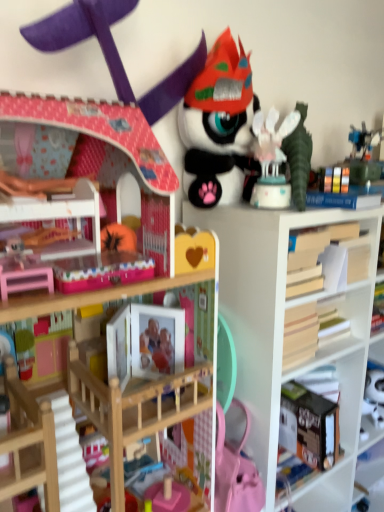
Question: Should I look upward or downward to see wooden book at right?

Choices:
 (A) up
 (B) down

Answer: (A)

Question: Is wooden bookcase at upper left outside of white matte bookshelf at center?

Choices:
 (A) yes
 (B) no

Answer: (A)

Question: From the image's perspective, is wooden bookcase at upper left beneath white matte bookshelf at center?

Choices:
 (A) no
 (B) yes

Answer: (A)

Question: From the image's perspective, is wooden bookcase at upper left above white matte bookshelf at center?

Choices:
 (A) no
 (B) yes

Answer: (B)

Question: Does wooden bookcase at upper left have a lesser width compared to white matte bookshelf at center?

Choices:
 (A) no
 (B) yes

Answer: (B)

Question: Is wooden bookcase at upper left far away from white matte bookshelf at center?

Choices:
 (A) no
 (B) yes

Answer: (A)

Question: From a real-world perspective, is wooden bookcase at upper left below white matte bookshelf at center?

Choices:
 (A) no
 (B) yes

Answer: (A)

Question: From a real-world perspective, is white glossy cake at upper right, the first toy viewed from the right, positioned over wooden book at right based on gravity?

Choices:
 (A) no
 (B) yes

Answer: (B)

Question: From the image's perspective, is white glossy cake at upper right, the first toy viewed from the right, on wooden book at right?

Choices:
 (A) yes
 (B) no

Answer: (A)

Question: Is white glossy cake at upper right, placed as the 3th toy when sorted from left to right, surrounding wooden book at right?

Choices:
 (A) yes
 (B) no

Answer: (B)

Question: Is white glossy cake at upper right, placed as the 3th toy when sorted from left to right, turned away from wooden book at right?

Choices:
 (A) no
 (B) yes

Answer: (A)

Question: Are white glossy cake at upper right, the first toy viewed from the right, and wooden book at right making contact?

Choices:
 (A) no
 (B) yes

Answer: (A)

Question: Is white glossy cake at upper right, placed as the 3th toy when sorted from left to right, oriented towards wooden book at right?

Choices:
 (A) yes
 (B) no

Answer: (B)

Question: Could you tell me if matte black plush toy at upper center, the second toy in the right-to-left sequence, is facing wooden book at right?

Choices:
 (A) yes
 (B) no

Answer: (B)